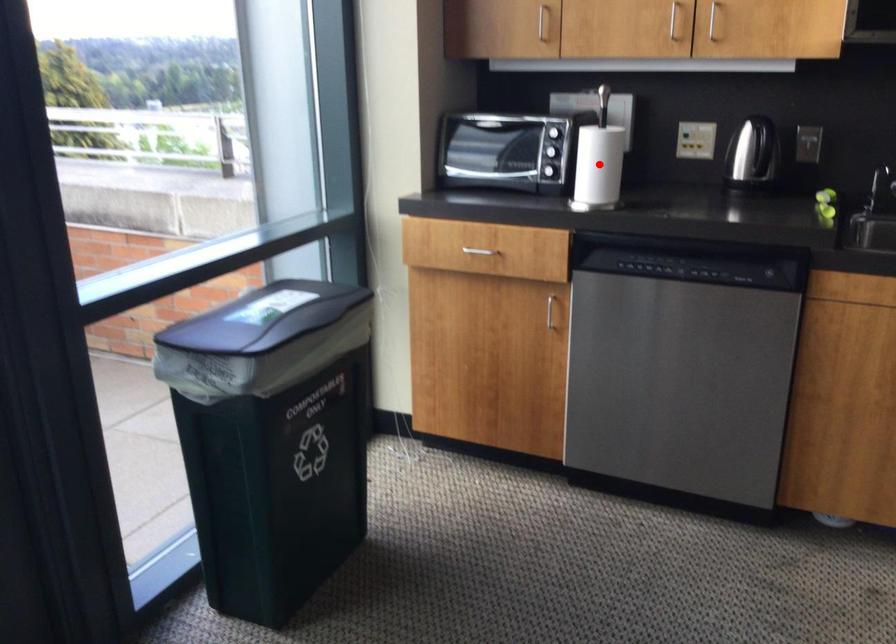
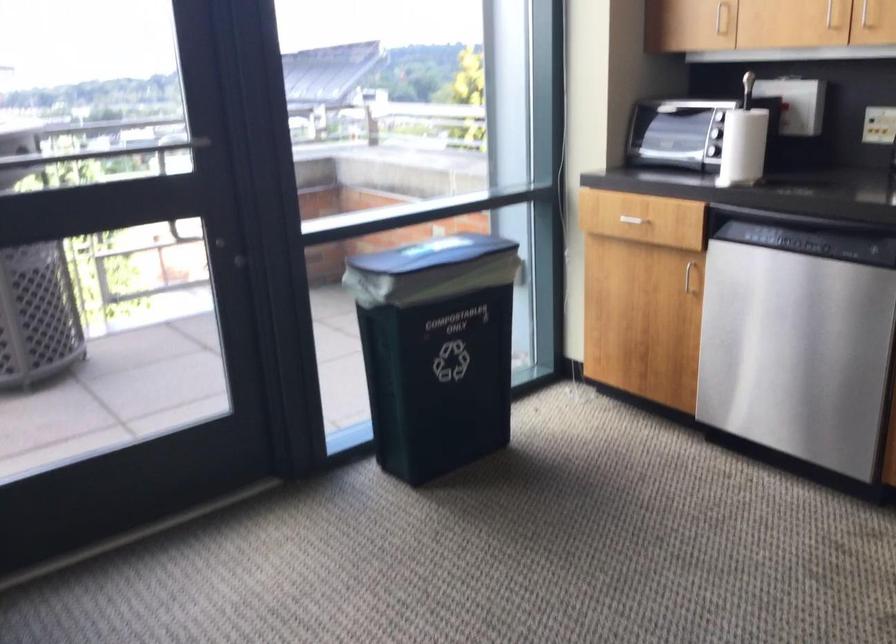
Where in the second image is the point corresponding to the highlighted location from the first image?

(743, 146)